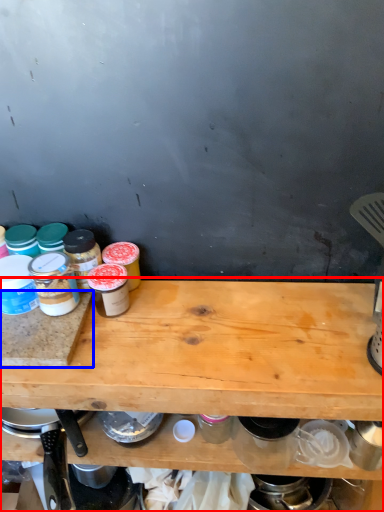
Question: Which of the following is the closest to the observer, table (highlighted by a red box) or cutting board (highlighted by a blue box)?

Choices:
 (A) table
 (B) cutting board

Answer: (A)